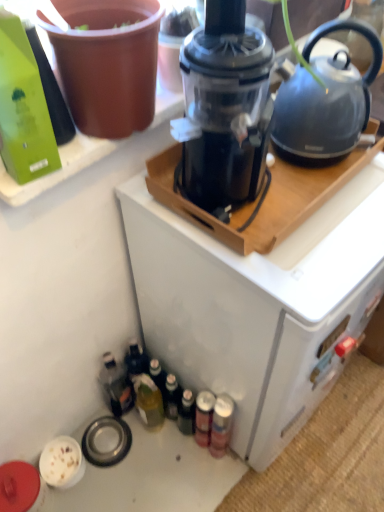
Question: From the image's perspective, is green matte bottle at upper left, which appears as the first bottle when viewed from the front, located above or below translucent glass bottle at lower left, which ranks as the first bottle in bottom-to-top order?

Choices:
 (A) below
 (B) above

Answer: (B)

Question: Is point (26, 27) closer or farther from the camera than point (132, 381)?

Choices:
 (A) farther
 (B) closer

Answer: (B)

Question: Estimate the real-world distances between objects in this image. Which object is farther from the translucent plastic bottle at lower left, which is the third bottle in front-to-back order?

Choices:
 (A) translucent glass bottle at lower left, which ranks as the first bottle in bottom-to-top order
 (B) green matte bottle at upper left, which appears as the first bottle when viewed from the front
 (C) matte gray kettle at upper right
 (D) black plastic blender at center

Answer: (C)

Question: Which is nearer to the black plastic blender at center?

Choices:
 (A) translucent plastic bottle at lower left, arranged as the 2th bottle when ordered from the bottom
 (B) matte gray kettle at upper right
 (C) green matte bottle at upper left, the first bottle in the top-to-bottom sequence
 (D) translucent glass bottle at lower left, which is counted as the 2th bottle, starting from the back

Answer: (B)